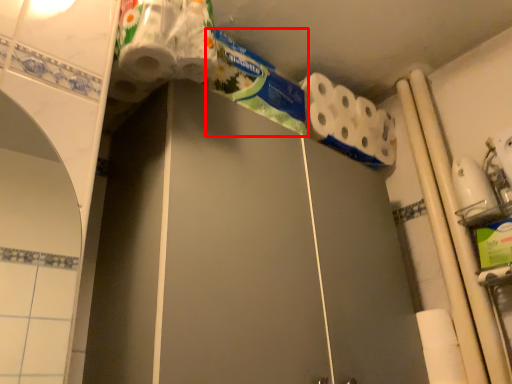
Question: Considering the relative positions of toothpaste (annotated by the red box) and toilet paper in the image provided, where is toothpaste (annotated by the red box) located with respect to the staircase?

Choices:
 (A) right
 (B) left

Answer: (B)